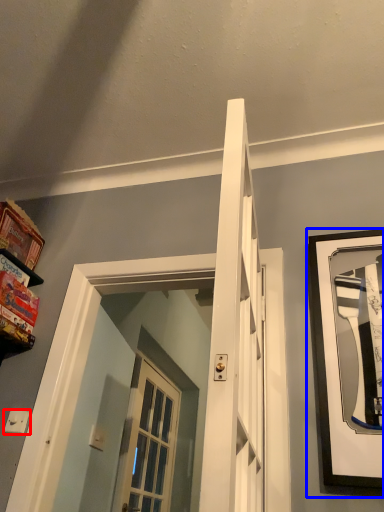
Question: Which object is closer to the camera taking this photo, light switch (highlighted by a red box) or picture frame (highlighted by a blue box)?

Choices:
 (A) light switch
 (B) picture frame

Answer: (B)